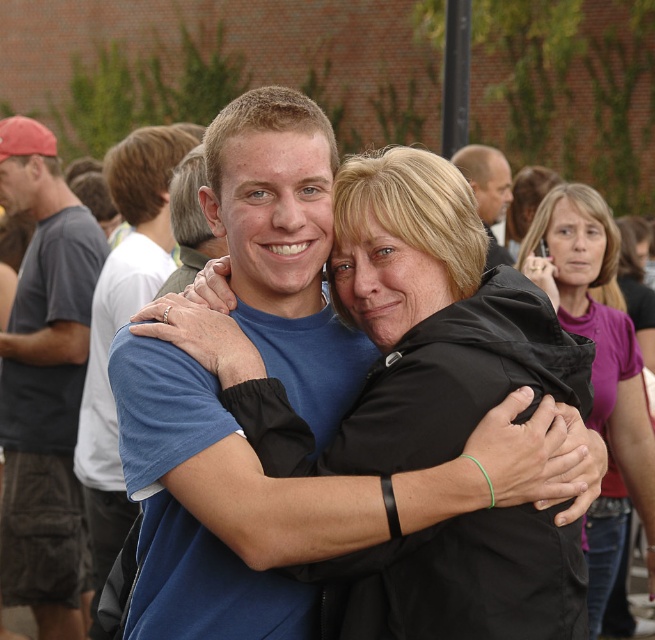
Does dark gray t-shirt at left come in front of purple matte shirt at upper right?

That is False.

Between dark gray t-shirt at left and purple matte shirt at upper right, which one is positioned lower?

purple matte shirt at upper right

This screenshot has height=640, width=655. What do you see at coordinates (45, 385) in the screenshot?
I see `dark gray t-shirt at left` at bounding box center [45, 385].

I want to click on dark gray t-shirt at left, so click(x=45, y=385).

Is point (45, 611) behind point (107, 278)?

Yes, it is.

Identify the location of dark gray t-shirt at left. (45, 385).

The image size is (655, 640). I want to click on purple matte shirt at upper right, so click(x=597, y=330).

Identify the location of purple matte shirt at upper right. Image resolution: width=655 pixels, height=640 pixels. (597, 330).